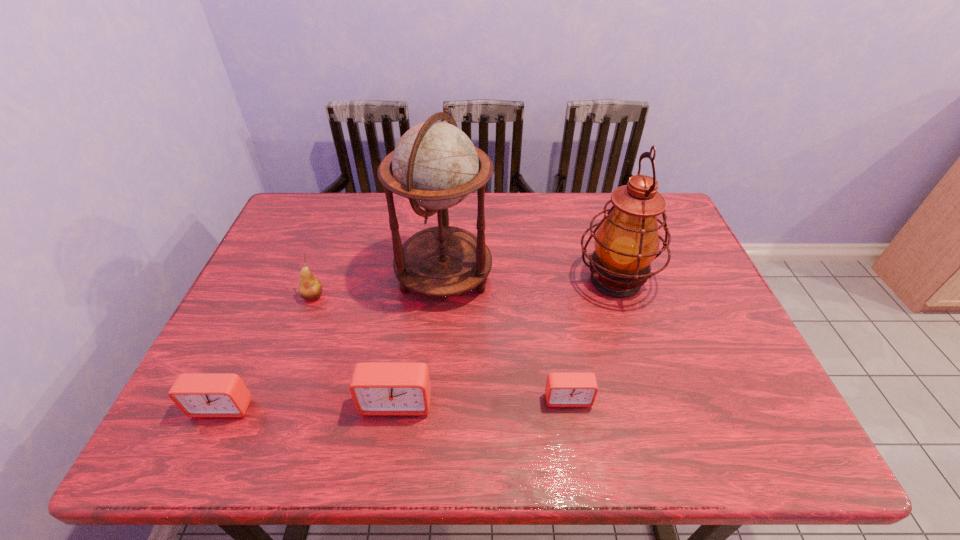
All alarm clocks are currently evenly spaced. To continue this pattern, where would you add another alarm clock on the right? Please point out a vacant spot. Please provide its 2D coordinates. Your answer should be formatted as a tuple, i.e. [(x, y)], where the tuple contains the x and y coordinates of a point satisfying the conditions above.

[(737, 395)]